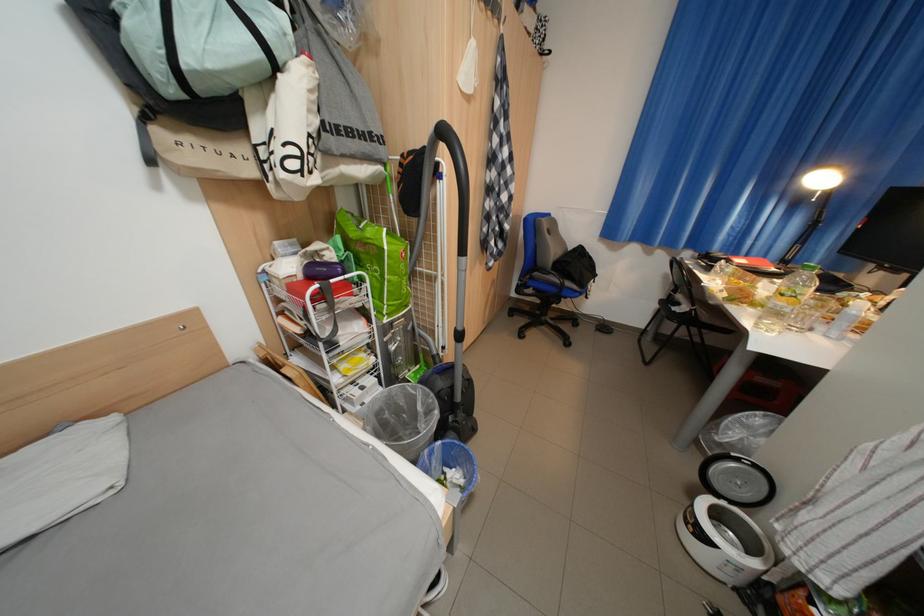
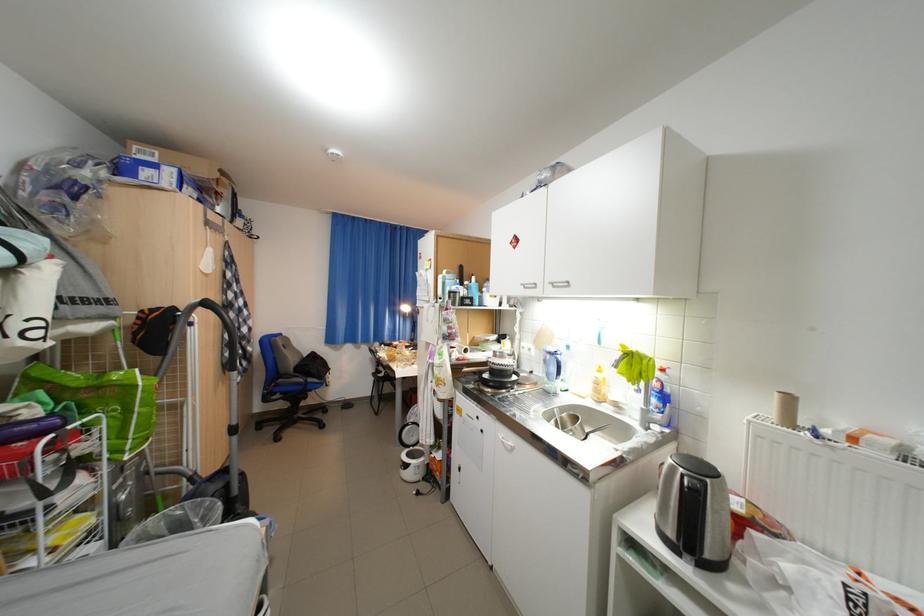
Where in the second image is the point corresponding to pixel 540 289 from the first image?

(286, 395)